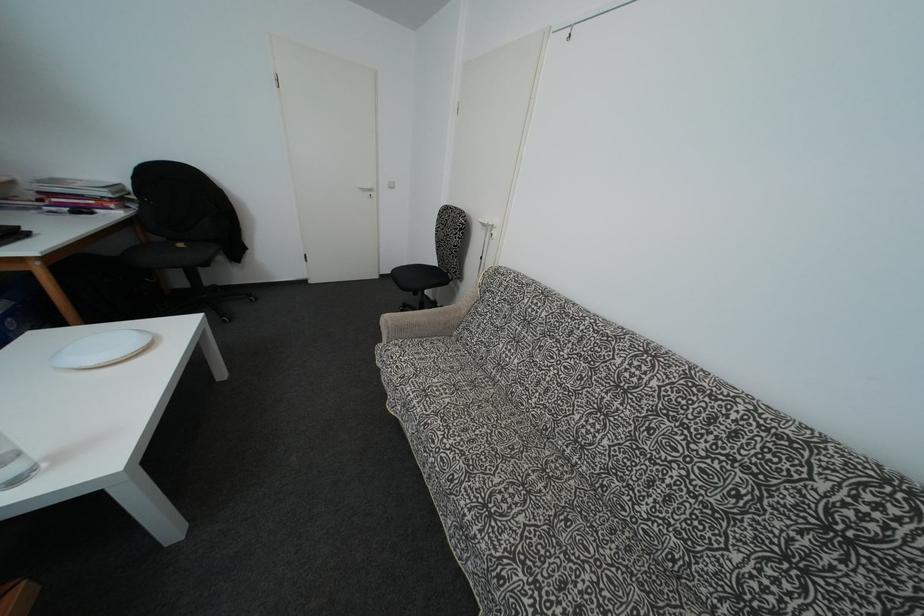
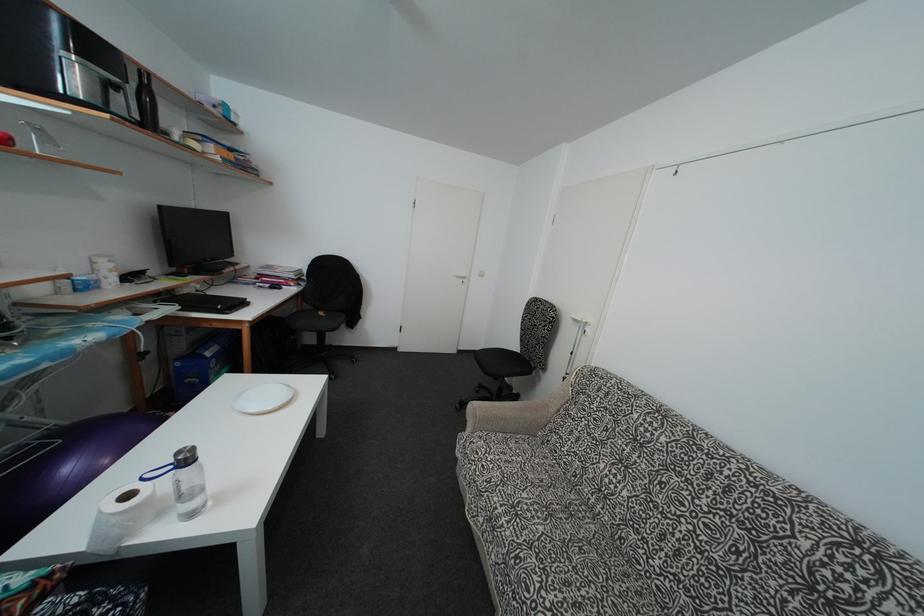
Find the pixel in the second image that matches (x=436, y=267) in the first image.

(517, 353)